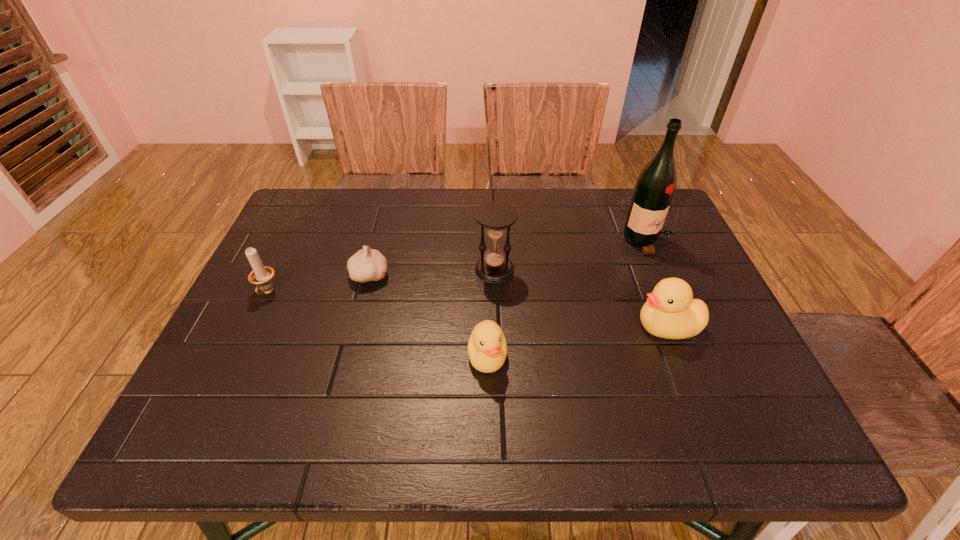
In order to click on free spot between the garlic and the candle_holder in this screenshot , I will do `click(319, 284)`.

Image resolution: width=960 pixels, height=540 pixels. In order to click on vacant space in between the shorter duck and the leftmost object in this screenshot , I will do pyautogui.click(x=377, y=325).

Identify the location of free area in between the right duck and the candle_holder. The height and width of the screenshot is (540, 960). (468, 309).

This screenshot has height=540, width=960. Find the location of `unoccupied area between the second object from left to right and the fifth tallest object`. unoccupied area between the second object from left to right and the fifth tallest object is located at coordinates (428, 316).

Where is `free space that is in between the shorter duck and the second object from left to right`? This screenshot has width=960, height=540. free space that is in between the shorter duck and the second object from left to right is located at coordinates (428, 316).

The height and width of the screenshot is (540, 960). I want to click on vacant region between the second tallest object and the wine bottle, so click(571, 255).

Where is `free point between the fifth shortest object and the wine bottle`? This screenshot has height=540, width=960. free point between the fifth shortest object and the wine bottle is located at coordinates (571, 255).

Where is `the closest object to the hourglass`? Image resolution: width=960 pixels, height=540 pixels. the closest object to the hourglass is located at coordinates (487, 349).

Find the location of `object that is the third closest to the taller duck`. object that is the third closest to the taller duck is located at coordinates (487, 349).

Where is `free space in the image that satisfies the following two spatial constraints: 1. at the beak of the taller duck; 2. at the beak of the shorter duck`? The height and width of the screenshot is (540, 960). free space in the image that satisfies the following two spatial constraints: 1. at the beak of the taller duck; 2. at the beak of the shorter duck is located at coordinates (679, 356).